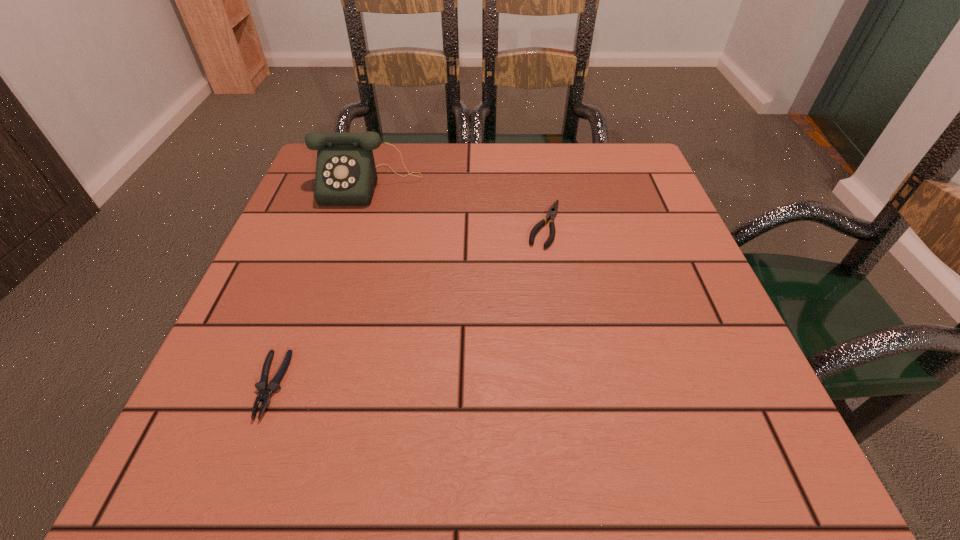
You are a GUI agent. You are given a task and a screenshot of the screen. Output one action in this format:
    pyautogui.click(x=<x>, y=<y>)
    Task: Click on the free space between the left pliers and the telephone
    The height and width of the screenshot is (540, 960).
    Given the screenshot: What is the action you would take?
    pyautogui.click(x=320, y=285)

Locate which object is the second closest to the rightmost object. Please provide its 2D coordinates. Your answer should be formatted as a tuple, i.e. [(x, y)], where the tuple contains the x and y coordinates of a point satisfying the conditions above.

[(265, 390)]

Select which object is the closest to the nearer pliers. Please provide its 2D coordinates. Your answer should be formatted as a tuple, i.e. [(x, y)], where the tuple contains the x and y coordinates of a point satisfying the conditions above.

[(346, 175)]

The image size is (960, 540). In order to click on free spot that satisfies the following two spatial constraints: 1. on the dial of the tallest object; 2. on the right side of the farther pliers in this screenshot , I will do `click(357, 224)`.

Where is `free space in the image that satisfies the following two spatial constraints: 1. on the dial of the telephone; 2. on the right side of the rightmost object`? free space in the image that satisfies the following two spatial constraints: 1. on the dial of the telephone; 2. on the right side of the rightmost object is located at coordinates (357, 224).

At what (x,y) coordinates should I click in order to perform the action: click on vacant region that satisfies the following two spatial constraints: 1. on the dial of the rightmost object; 2. on the right side of the telephone. Please return your answer as a coordinate pair (x, y). Looking at the image, I should click on (357, 224).

Locate an element on the screen. The width and height of the screenshot is (960, 540). vacant area in the image that satisfies the following two spatial constraints: 1. on the dial of the tallest object; 2. on the left side of the right pliers is located at coordinates (357, 224).